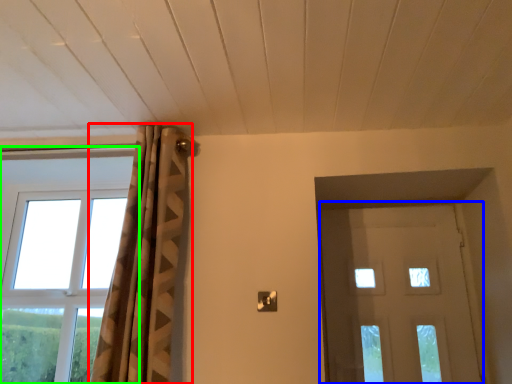
Question: Estimate the real-world distances between objects in this image. Which object is closer to curtain (highlighted by a red box), door (highlighted by a blue box) or window (highlighted by a green box)?

Choices:
 (A) door
 (B) window

Answer: (B)